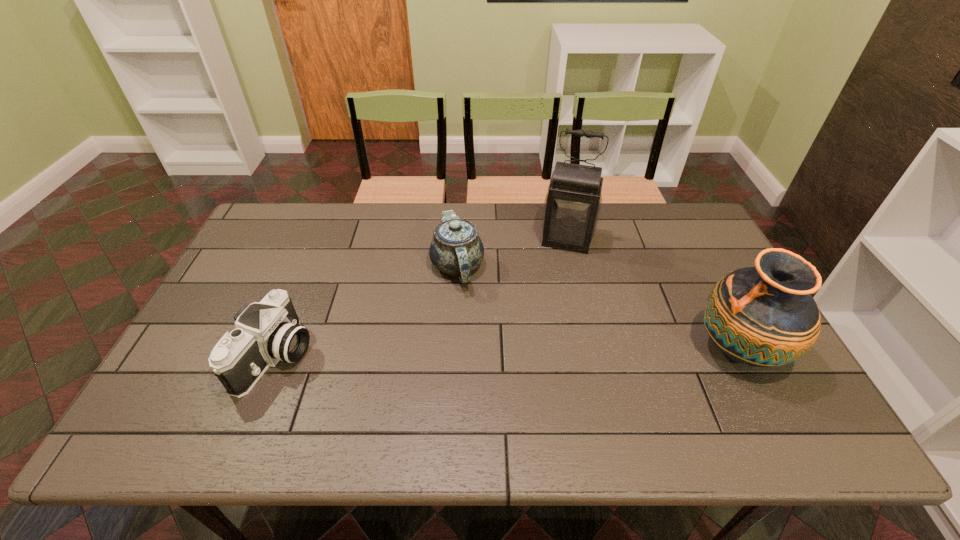
This screenshot has width=960, height=540. I want to click on free space on the desktop that is between the camera and the rightmost object and is positioned on the front-facing side of the third object from left to right, so click(543, 353).

Where is `free space on the desktop that is between the camera and the third shortest object and is positioned from the spout of the chinaware`? The image size is (960, 540). free space on the desktop that is between the camera and the third shortest object and is positioned from the spout of the chinaware is located at coordinates (440, 354).